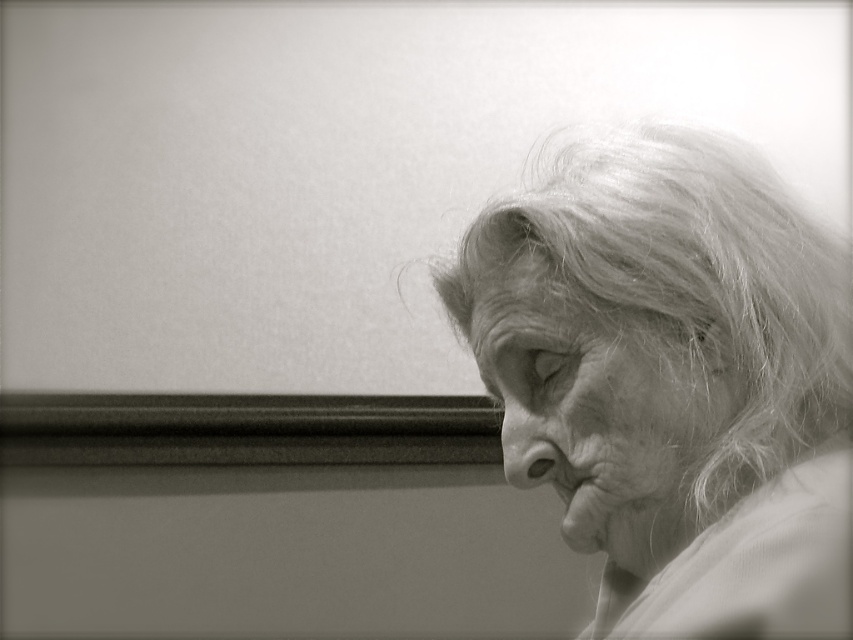
Question: Does smooth skin nose at center have a greater width compared to smooth skin mouth at lower right?

Choices:
 (A) yes
 (B) no

Answer: (A)

Question: Among these points, which one is farthest from the camera?

Choices:
 (A) (650, 428)
 (B) (564, 435)
 (C) (589, 483)

Answer: (C)

Question: Can you confirm if smooth skin nose at center is thinner than smooth skin mouth at lower right?

Choices:
 (A) yes
 (B) no

Answer: (B)

Question: Among these objects, which one is nearest to the camera?

Choices:
 (A) smooth skin nose at center
 (B) smooth skin face at right
 (C) smooth skin mouth at lower right
 (D) smooth skin face at center

Answer: (B)

Question: Which is farther from the smooth skin nose at center?

Choices:
 (A) smooth skin face at right
 (B) smooth skin mouth at lower right
 (C) smooth skin face at center

Answer: (A)

Question: Can you confirm if smooth skin face at right is positioned to the right of smooth skin mouth at lower right?

Choices:
 (A) no
 (B) yes

Answer: (B)